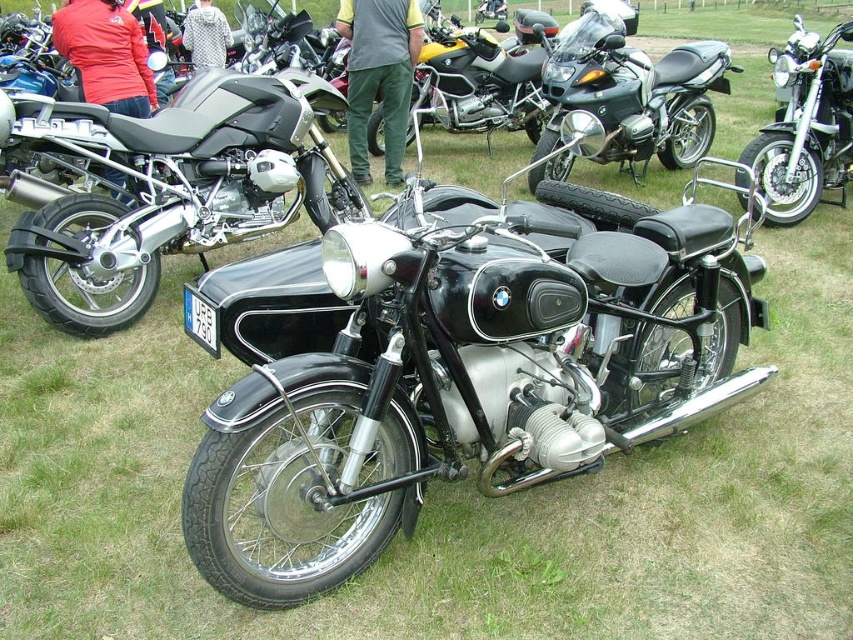
You are a photographer setting up for a shoot. You need to position a tripod between the black matte motorcycle at center and the brushed metal jacket at upper center. Given that the tripod requires a minimum space of 1 meter between the two objects to set up properly, can you determine if there is enough space based on their widths?

The black matte motorcycle at center is wider than the brushed metal jacket at upper center, but the question is about the distance between them. The provided information only states their widths, not the actual distance between the two objects. Therefore, it is impossible to determine if there is enough space for the tripod based on the given details.

You are a photographer setting up a backdrop for a photo shoot. You have two jackets to use as props, the red fabric jacket at upper left and the brushed metal jacket at upper center. Which jacket should you choose if you want the one that is wider to ensure it covers more of the background?

The red fabric jacket at upper left might be wider than the brushed metal jacket at upper center, so you should choose the red fabric jacket at upper left to cover more of the background.

You are a photographer trying to capture a clear shot of the shiny black motorcycle at center and the brushed metal jacket at upper center. Which object should you focus on first if you want to ensure both are in focus, considering their sizes in the frame?

The shiny black motorcycle at center is taller than the brushed metal jacket at upper center, so focusing on the taller object first would help ensure both are in focus.